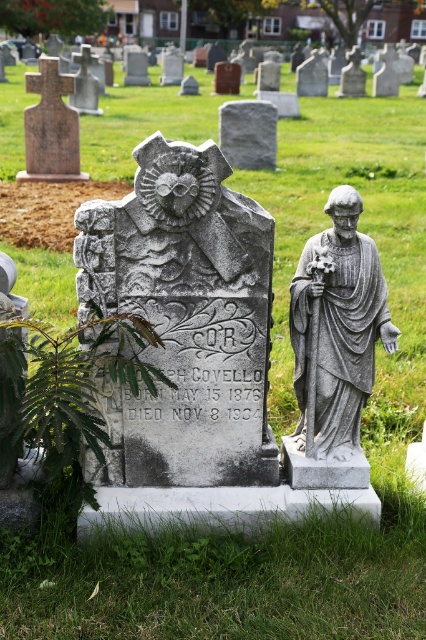
You are a groundskeeper trying to place a new flowerpot between the gray stone statue at right and the gray stone gravestone at center. Based on their sizes, which object should you position closer to the flowerpot to ensure it fits?

Since the gray stone statue at right is smaller than the gray stone gravestone at center, you should place the flowerpot closer to the gray stone statue at right to accommodate their sizes.

You are visiting the cemetery and want to place a bouquet of flowers between the gray stone owl at center and the gray stone statue at right. Which object should you place the flowers closer to if you want them to be closer to the larger object?

You should place the bouquet of flowers closer to the gray stone owl at center because it is larger than the gray stone statue at right.